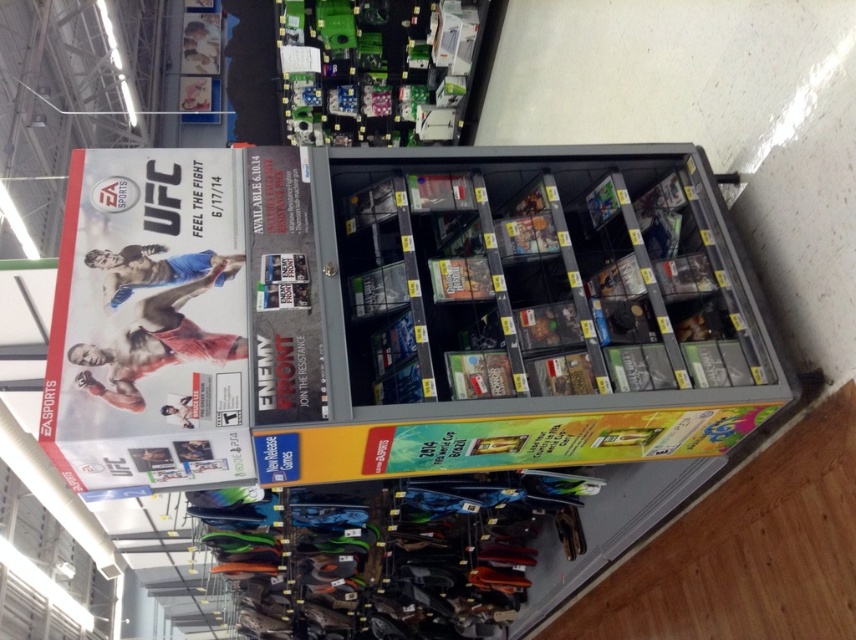
Does metallic gray shelf at center have a lesser width compared to matte plastic ufc poster at upper left?

In fact, metallic gray shelf at center might be wider than matte plastic ufc poster at upper left.

Can you confirm if metallic gray shelf at center is positioned above matte plastic ufc poster at upper left?

Incorrect, metallic gray shelf at center is not positioned above matte plastic ufc poster at upper left.

Who is more forward, (x=330, y=320) or (x=238, y=432)?

Point (x=238, y=432) is in front.

The width and height of the screenshot is (856, 640). What are the coordinates of `metallic gray shelf at center` in the screenshot? It's located at (535, 282).

Who is positioned more to the right, matte plastic ufc poster at upper left or green plastic electronics at upper center?

From the viewer's perspective, green plastic electronics at upper center appears more on the right side.

Can you confirm if matte plastic ufc poster at upper left is thinner than green plastic electronics at upper center?

Indeed, matte plastic ufc poster at upper left has a lesser width compared to green plastic electronics at upper center.

Describe the element at coordinates (147, 323) in the screenshot. I see `matte plastic ufc poster at upper left` at that location.

At what (x,y) coordinates should I click in order to perform the action: click on matte plastic ufc poster at upper left. Please return your answer as a coordinate pair (x, y). Looking at the image, I should click on (147, 323).

Can you confirm if metallic gray shelf at center is shorter than green plastic electronics at upper center?

Yes.

This screenshot has width=856, height=640. Describe the element at coordinates (535, 282) in the screenshot. I see `metallic gray shelf at center` at that location.

Image resolution: width=856 pixels, height=640 pixels. Find the location of `metallic gray shelf at center`. metallic gray shelf at center is located at coordinates (535, 282).

Find the location of a particular element. metallic gray shelf at center is located at coordinates (535, 282).